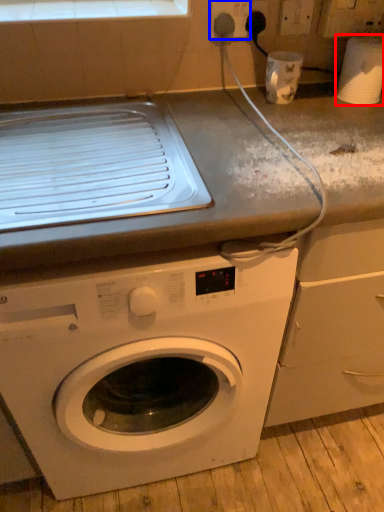
Question: Which of the following is the closest to the observer, appliance (highlighted by a red box) or electric outlet (highlighted by a blue box)?

Choices:
 (A) appliance
 (B) electric outlet

Answer: (A)